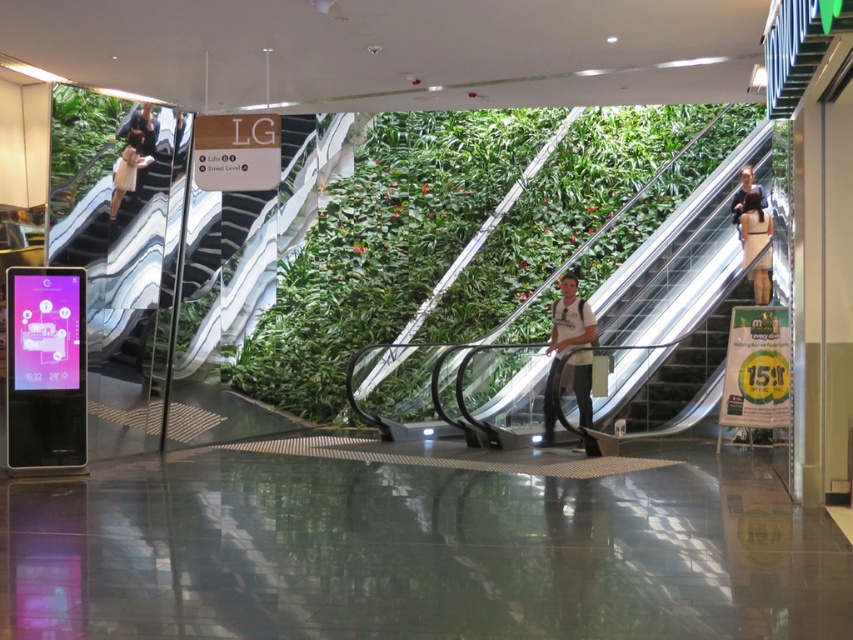
Question: Which object is positioned farthest from the green leafy wall at center?

Choices:
 (A) dark brown leather jacket at upper left
 (B) light brown leather handbag at upper left
 (C) dark brown leather jacket at upper right

Answer: (B)

Question: Which is nearer to the dark brown leather jacket at upper right?

Choices:
 (A) light brown leather handbag at upper left
 (B) light brown leather dress at upper right
 (C) dark brown leather jacket at upper left

Answer: (B)

Question: Can you confirm if metallic escalator at right is bigger than light brown leather handbag at upper left?

Choices:
 (A) no
 (B) yes

Answer: (B)

Question: Which point is farther to the camera?

Choices:
 (A) (738, 289)
 (B) (582, 312)

Answer: (A)

Question: Does light brown leather dress at upper right come in front of light brown leather handbag at upper left?

Choices:
 (A) no
 (B) yes

Answer: (A)

Question: From the image, what is the correct spatial relationship of green leafy wall at center in relation to dark brown leather jacket at upper left?

Choices:
 (A) right
 (B) left

Answer: (A)